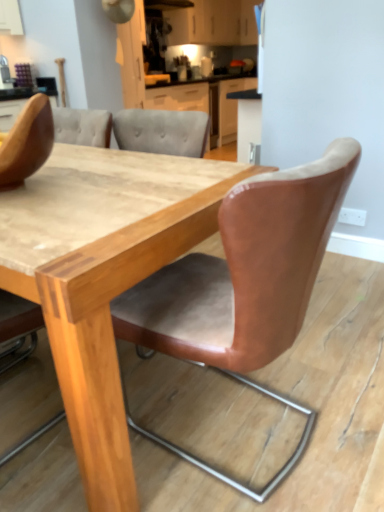
Question: Considering their positions, is wooden table at center located in front of or behind brown leather chair at upper left, which is counted as the 1th chair, starting from the left?

Choices:
 (A) front
 (B) behind

Answer: (A)

Question: From a real-world perspective, is wooden table at center above or below brown leather chair at upper left, which is counted as the 1th chair, starting from the left?

Choices:
 (A) above
 (B) below

Answer: (B)

Question: Estimate the real-world distances between objects in this image. Which object is closer to the matte white cabinets at upper center?

Choices:
 (A) brown leather chair at upper left, arranged as the second chair when viewed from the right
 (B) leather-like tan chair at center, positioned as the second chair in left-to-right order
 (C) wooden table at center

Answer: (C)

Question: Considering the real-world distances, which object is farthest from the matte white cabinets at upper center?

Choices:
 (A) wooden table at center
 (B) leather-like tan chair at center, the 1th chair in the right-to-left sequence
 (C) brown leather chair at upper left, which is counted as the 1th chair, starting from the left

Answer: (B)